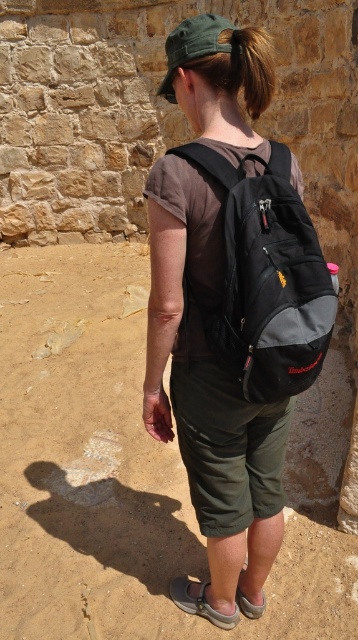
You are planning to pack for a hiking trip and have two backpacks available. The matte black backpack at center and the black fabric backpack at back. Which backpack has a greater width?

The matte black backpack at center has a greater width than the black fabric backpack at back according to the description.

You are navigating a dusty outdoor area and need to locate the matte black backpack at center. Based on the coordinates provided in the scene description, can you determine its position relative to the stone wall in the background?

The matte black backpack at center is located at coordinates point [210,392]. Since the coordinates are relative to the image frame, the backpack is positioned towards the lower right quadrant, closer to the stone wall in the background.